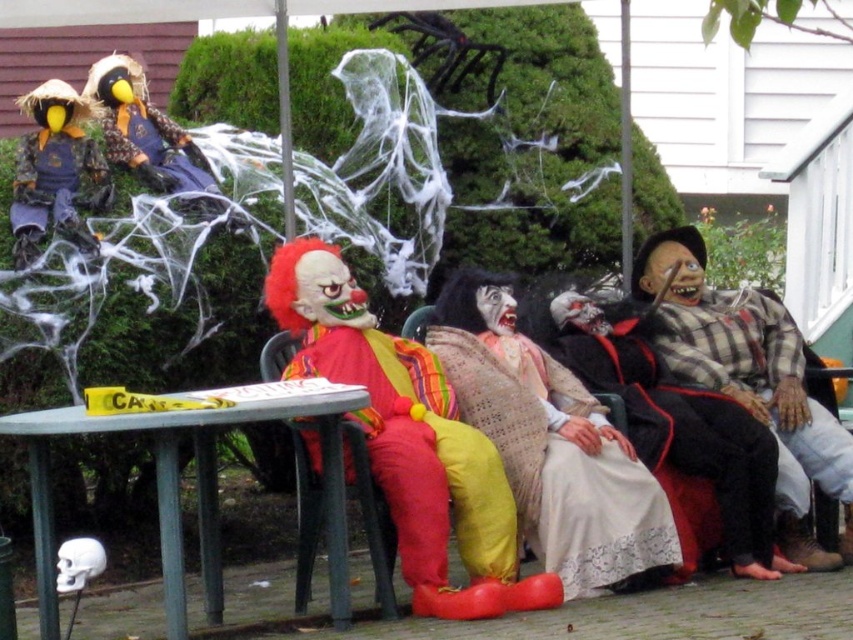
Question: Does metallic gray table at center lie in front of matte yellow and brown costume at upper left?

Choices:
 (A) no
 (B) yes

Answer: (B)

Question: Does plaid fabric scarecrow at right appear under matte yellow scarecrow at upper left?

Choices:
 (A) no
 (B) yes

Answer: (B)

Question: Is matte clown costume at center below plaid fabric ghost at center?

Choices:
 (A) yes
 (B) no

Answer: (B)

Question: Which point appears farthest from the camera in this image?

Choices:
 (A) (329, 586)
 (B) (302, 317)
 (C) (685, 464)
 (D) (209, 180)

Answer: (D)

Question: Which object is closer to the camera taking this photo?

Choices:
 (A) white lace dress at center
 (B) matte yellow scarecrow at upper left
 (C) matte clown costume at center

Answer: (C)

Question: Which object appears farthest from the camera in this image?

Choices:
 (A) plaid fabric ghost at center
 (B) metallic gray table at center
 (C) plaid fabric scarecrow at right
 (D) matte yellow scarecrow at upper left

Answer: (D)